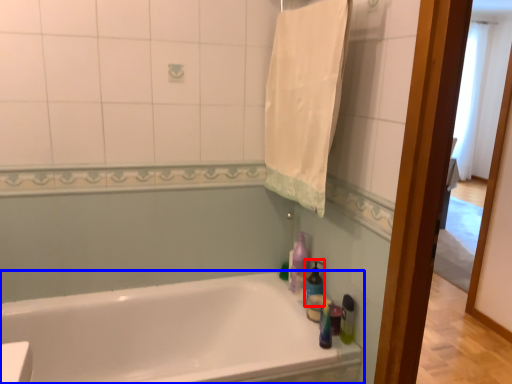
Question: Among these objects, which one is farthest to the camera, cleaning product (highlighted by a red box) or bathtub (highlighted by a blue box)?

Choices:
 (A) cleaning product
 (B) bathtub

Answer: (A)